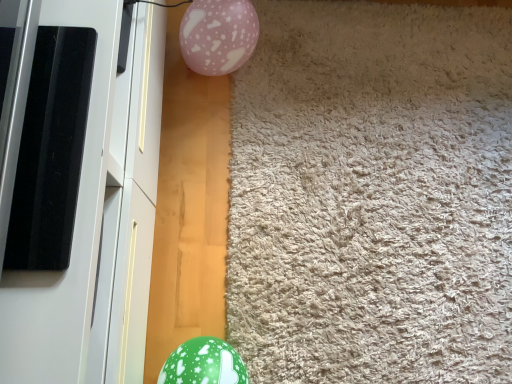
Identify the location of vacant area that lies between green glossy balloon at lower left and beige shaggy carpet at center. point(210,225).